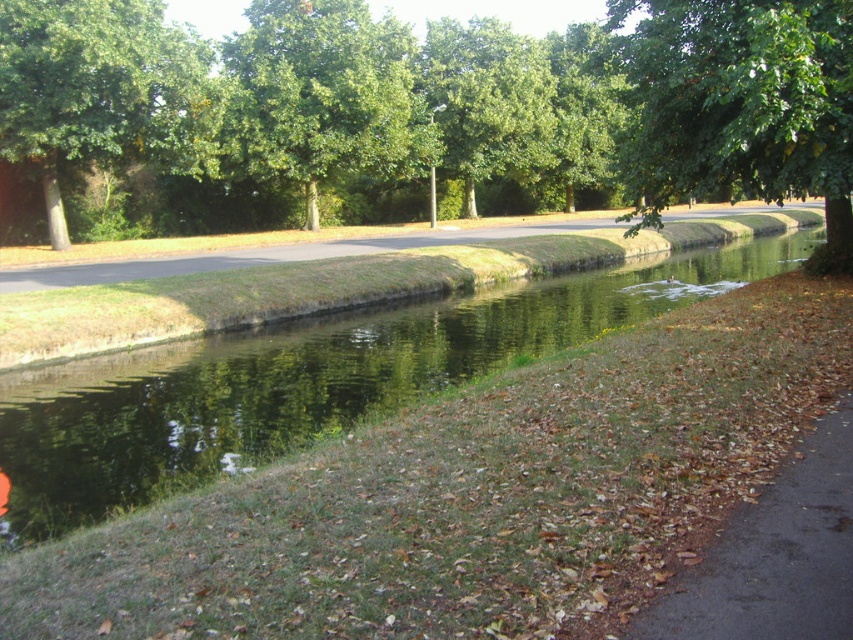
Question: Is green leafy tree at upper center positioned in front of green grass at center?

Choices:
 (A) yes
 (B) no

Answer: (B)

Question: In this image, where is green leafy tree at upper right located relative to green grass at center?

Choices:
 (A) below
 (B) above

Answer: (A)

Question: Is green leafy tree at center positioned before green grassy river at center?

Choices:
 (A) no
 (B) yes

Answer: (A)

Question: Which object appears farthest from the camera in this image?

Choices:
 (A) green grassy river at center
 (B) brown asphalt pavement at lower right
 (C) green leafy tree at upper left

Answer: (C)

Question: Estimate the real-world distances between objects in this image. Which object is closer to the brown asphalt pavement at lower right?

Choices:
 (A) green leafy tree at upper center
 (B) green grass at center
 (C) green leafy tree at center

Answer: (B)

Question: Which object is closer to the camera taking this photo?

Choices:
 (A) green leafy tree at center
 (B) green leafy tree at upper left
 (C) brown asphalt pavement at lower right
 (D) green grassy river at center

Answer: (C)